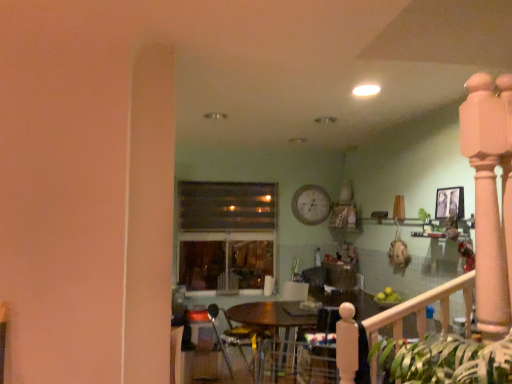
Question: Which direction should I rotate to look at metallic silver armchair at center, the 2th armchair positioned from the right, — up or down?

Choices:
 (A) down
 (B) up

Answer: (A)

Question: Considering the relative positions of wooden table at center and white wooden clock at upper center in the image provided, is wooden table at center to the right of white wooden clock at upper center from the viewer's perspective?

Choices:
 (A) no
 (B) yes

Answer: (A)

Question: Is wooden table at center further to the viewer compared to white wooden clock at upper center?

Choices:
 (A) yes
 (B) no

Answer: (B)

Question: Can you confirm if wooden table at center is taller than white wooden clock at upper center?

Choices:
 (A) no
 (B) yes

Answer: (B)

Question: Is white wooden clock at upper center a part of wooden table at center?

Choices:
 (A) no
 (B) yes

Answer: (A)

Question: Is wooden table at center looking in the opposite direction of white wooden clock at upper center?

Choices:
 (A) yes
 (B) no

Answer: (B)

Question: Does wooden table at center touch white wooden clock at upper center?

Choices:
 (A) no
 (B) yes

Answer: (A)

Question: Considering the relative sizes of white wooden clock at upper center and metallic silver armchair at center, the 2th armchair positioned from the right, in the image provided, is white wooden clock at upper center wider than metallic silver armchair at center, the 2th armchair positioned from the right,?

Choices:
 (A) yes
 (B) no

Answer: (B)

Question: From the image's perspective, is white wooden clock at upper center beneath metallic silver armchair at center, which ranks as the first armchair in left-to-right order?

Choices:
 (A) yes
 (B) no

Answer: (B)

Question: Is metallic silver armchair at center, which ranks as the first armchair in left-to-right order, completely or partially inside white wooden clock at upper center?

Choices:
 (A) yes
 (B) no

Answer: (B)

Question: Is white wooden clock at upper center to the right of metallic silver armchair at center, which ranks as the first armchair in left-to-right order, from the viewer's perspective?

Choices:
 (A) yes
 (B) no

Answer: (A)

Question: Is white wooden clock at upper center facing towards metallic silver armchair at center, which ranks as the first armchair in left-to-right order?

Choices:
 (A) no
 (B) yes

Answer: (A)

Question: Does white wooden clock at upper center have a larger size compared to metallic silver armchair at center, which ranks as the first armchair in left-to-right order?

Choices:
 (A) no
 (B) yes

Answer: (A)

Question: Does velvet dark blue armchair at center, the second armchair positioned from the left, have a lesser width compared to white wooden clock at upper center?

Choices:
 (A) yes
 (B) no

Answer: (B)